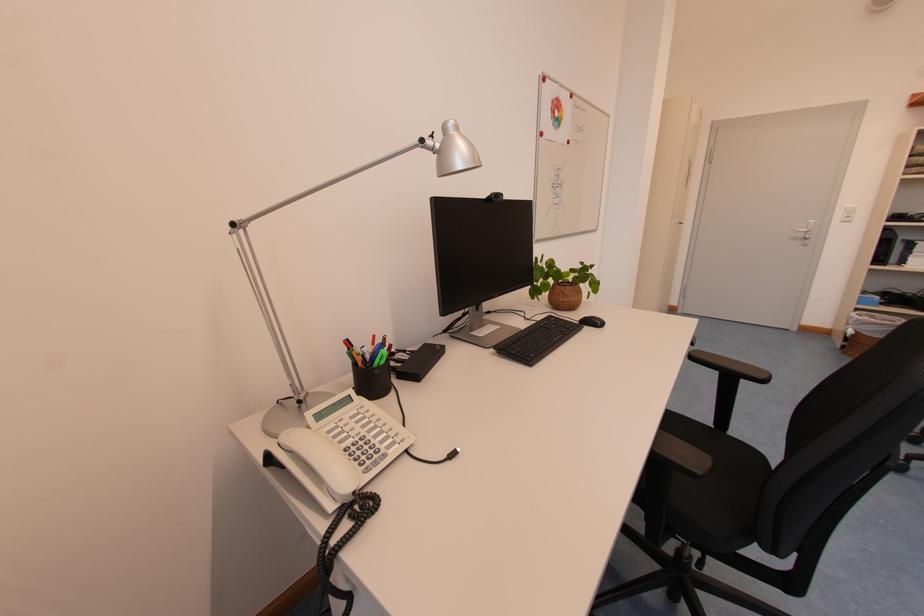
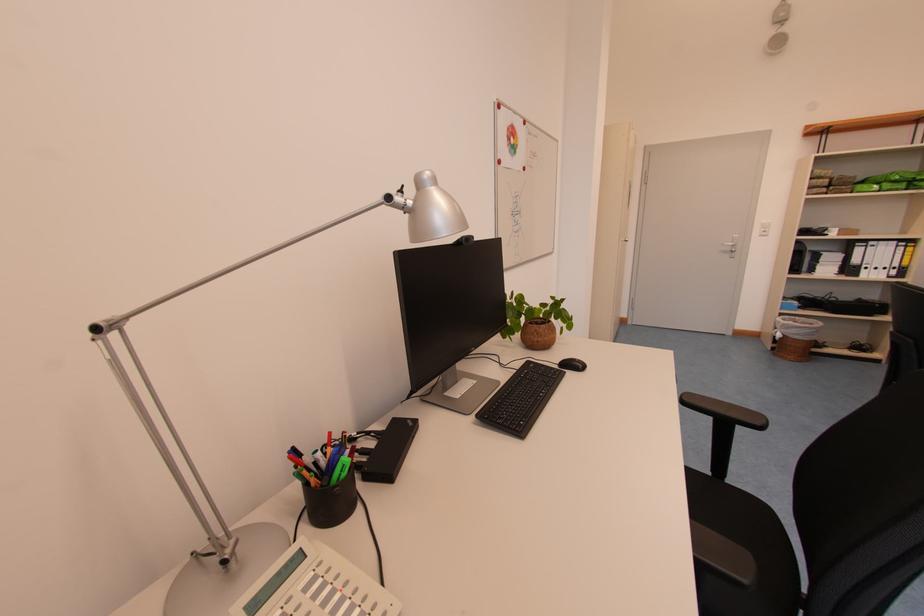
Question: I am providing you with two images of the same scene from different viewpoints. Please identify which objects are invisible in image2.

Choices:
 (A) silver door handle
 (B) green marker
 (C) black binder
 (D) none of these

Answer: (D)